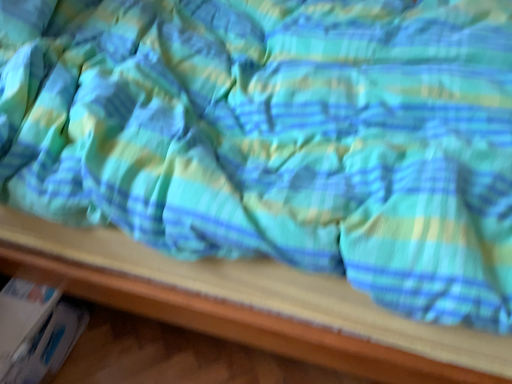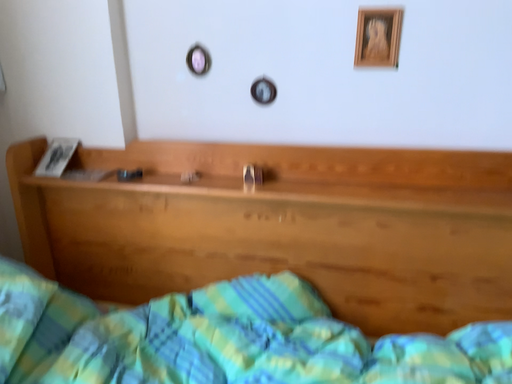
Question: Which way did the camera rotate in the video?

Choices:
 (A) rotated downward
 (B) rotated upward

Answer: (B)